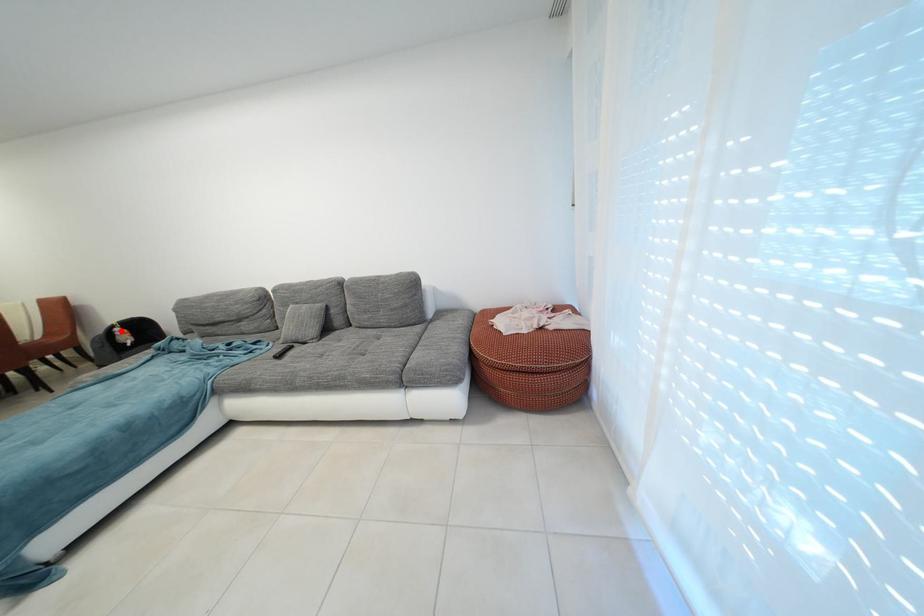
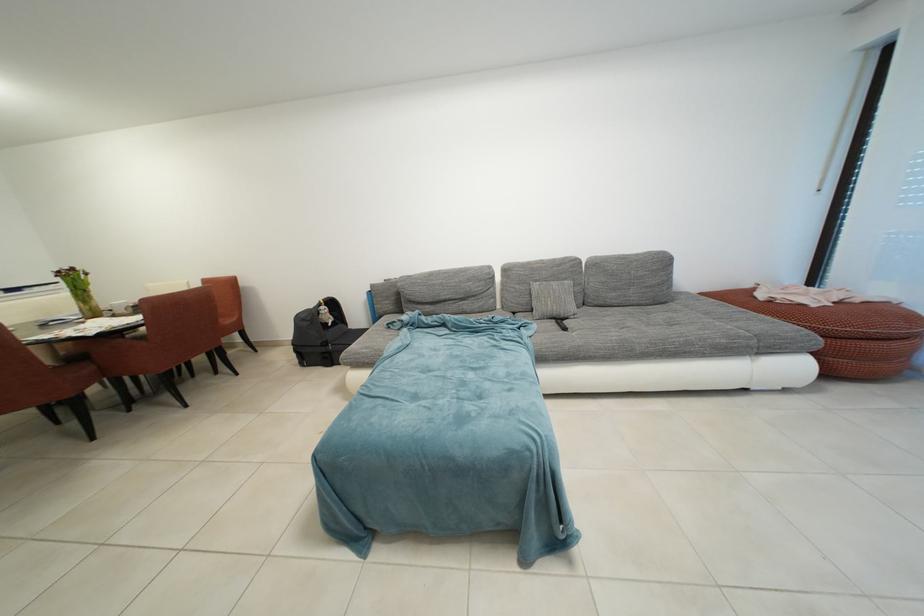
The point at the highlighted location is marked in the first image. Where is the corresponding point in the second image?

(329, 309)